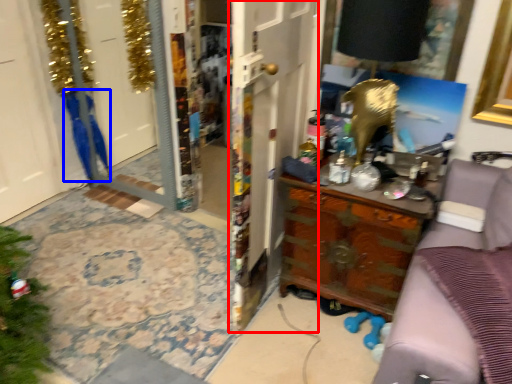
Question: Which point is closer to the camera, door (highlighted by a red box) or robe (highlighted by a blue box)?

Choices:
 (A) door
 (B) robe

Answer: (A)